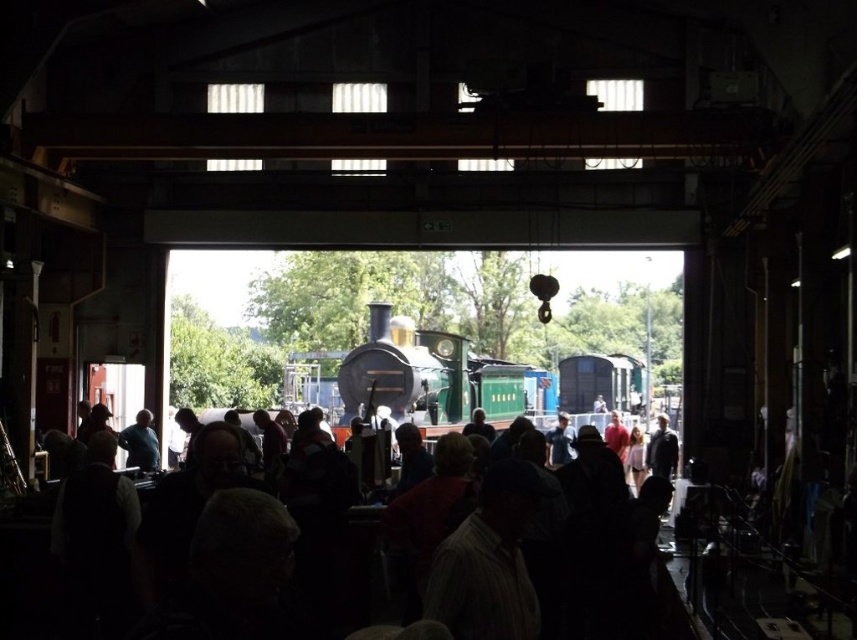
You are standing in the railway shed and want to find the matte blue shirt at left. Which direction should you look to see it relative to the dark fabric crowd at center?

The matte blue shirt at left is to the left of the dark fabric crowd at center, so you should look to the left of the dark fabric crowd at center to find it.

You are a photographer trying to capture a photo of the polished black locomotive at center without any obstructions. Given the dark fabric crowd at center, can you estimate if there is enough space to frame the locomotive without the crowd blocking it?

The dark fabric crowd at center has a lesser width compared to the polished black locomotive at center, so there is enough space to frame the locomotive without the crowd blocking it.

You are standing in the railway shed and want to take a photo of the polished black locomotive at center and the matte blue shirt at left. Which object should you position to your left side in the camera frame?

The matte blue shirt at left should be positioned to your left side in the camera frame because the polished black locomotive at center is to the right of the matte blue shirt at left.